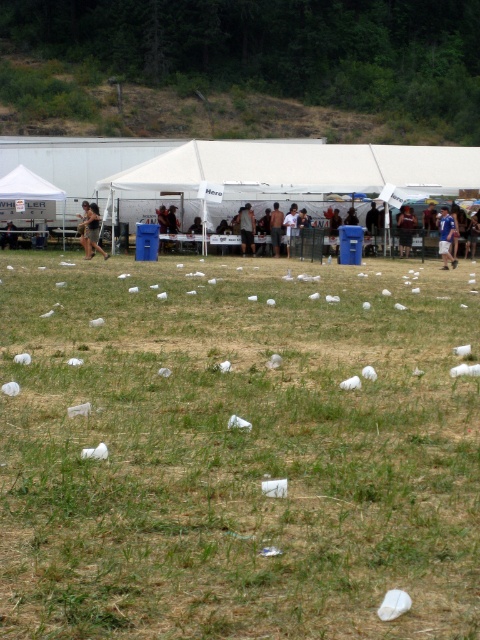
You are standing at the festival and want to know which of the two points, point (260, 518) or point (421, 145), is closer to you. Can you determine this based on their positions?

Point (260, 518) is closer to the viewer than point (421, 145), so it is the closer one.

You are organizing a cleanup crew and need to determine which shirt to prioritize based on visibility. The blue shirt at center and the dark gray shirt at center are both in the same area. Which shirt is wider and thus more visible from a distance?

The blue shirt at center is wider than the dark gray shirt at center, making it more visible from a distance.

You are standing at the origin point of the coordinate system. You want to move towards the blue shirt at center. What direction should you go in?

Since the blue shirt at center is located at coordinate point (x=445, y=236), you should move in the positive y direction to reach it.